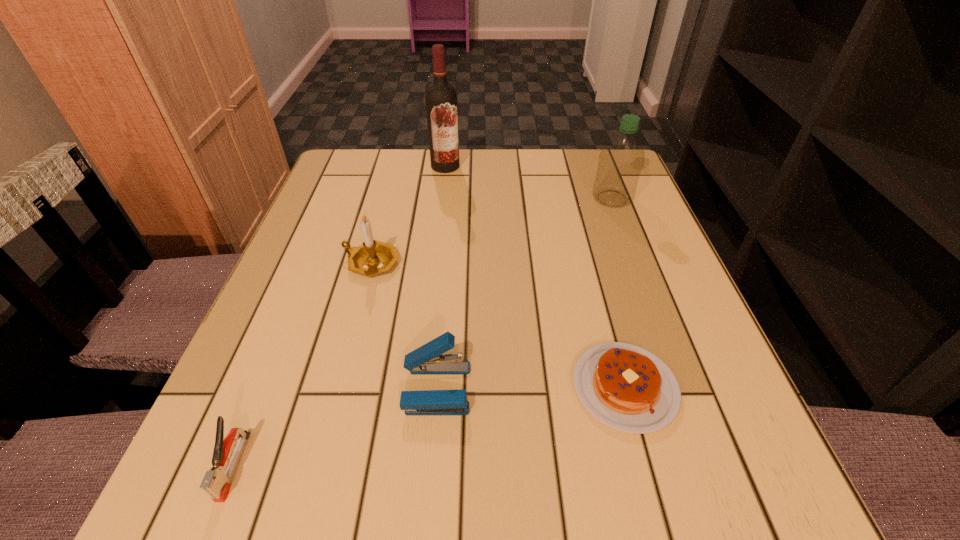
Image resolution: width=960 pixels, height=540 pixels. What are the coordinates of `object that stands as the fourth closest to the second farthest object` in the screenshot? It's located at (428, 359).

Find the location of a particular element. The width and height of the screenshot is (960, 540). object that can be found as the fifth closest to the fourth nearest object is located at coordinates (621, 159).

Find the location of a particular element. vacant space that satisfies the following two spatial constraints: 1. on the label of the tallest object; 2. on the left side of the pancake is located at coordinates (421, 387).

Locate an element on the screen. This screenshot has width=960, height=540. vacant region that satisfies the following two spatial constraints: 1. on the back side of the water bottle; 2. on the right side of the farther stapler is located at coordinates (452, 198).